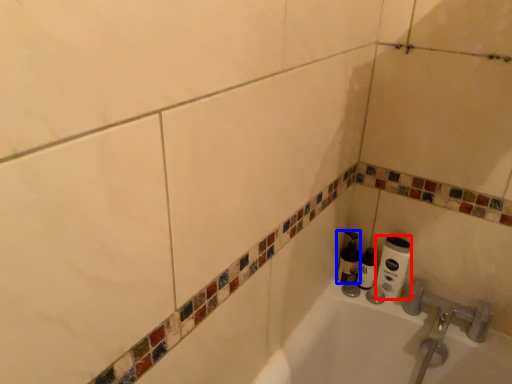
Question: Which object is further to the camera taking this photo, toilet paper (highlighted by a red box) or shaving cream (highlighted by a blue box)?

Choices:
 (A) toilet paper
 (B) shaving cream

Answer: (B)